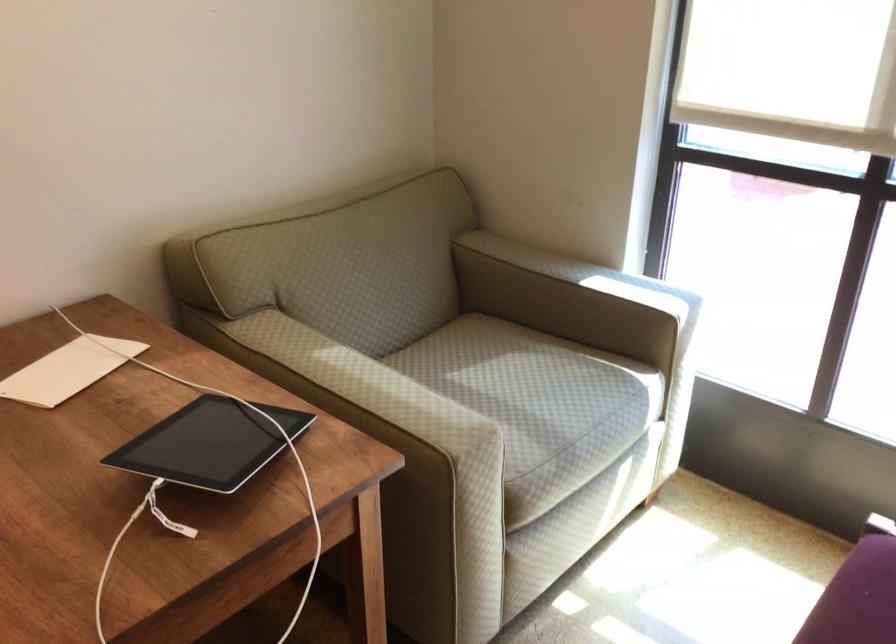
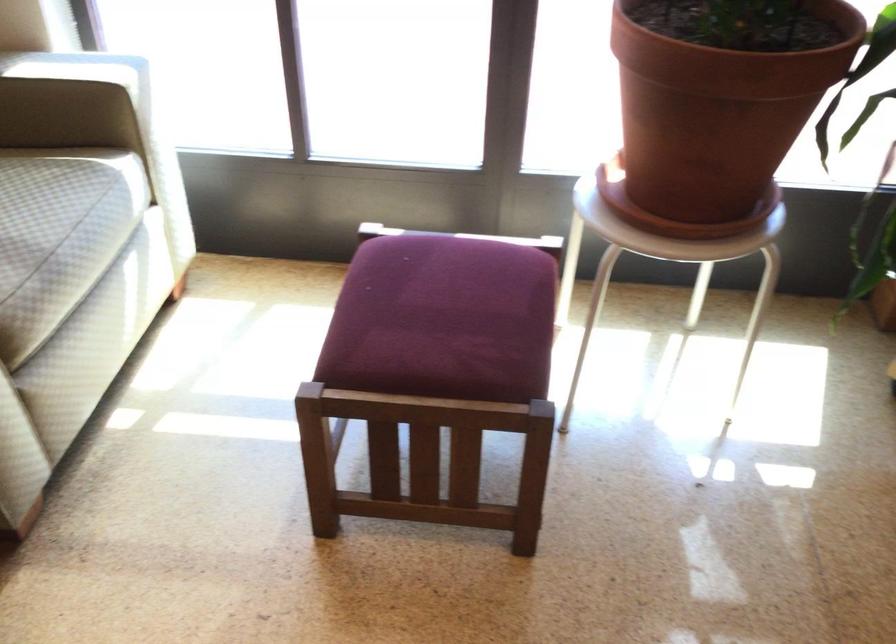
The images are taken continuously from a first-person perspective. In which direction is your viewpoint rotating?

The camera's rotation is toward right-down.